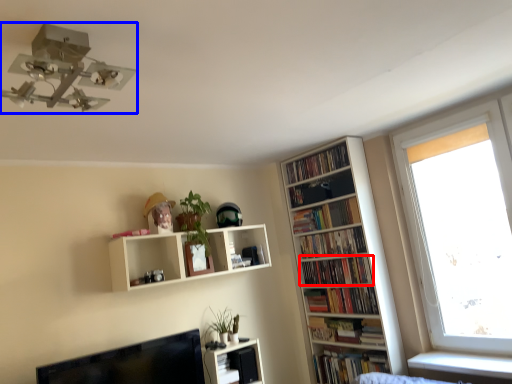
Question: Among these objects, which one is nearest to the camera, book (highlighted by a red box) or light fixture (highlighted by a blue box)?

Choices:
 (A) book
 (B) light fixture

Answer: (B)